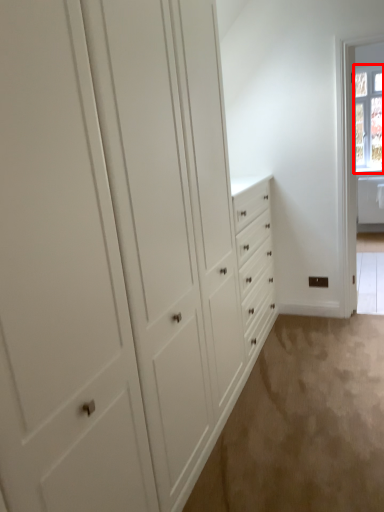
Question: Where is window (annotated by the red box) located in relation to plain in the image?

Choices:
 (A) right
 (B) left

Answer: (A)